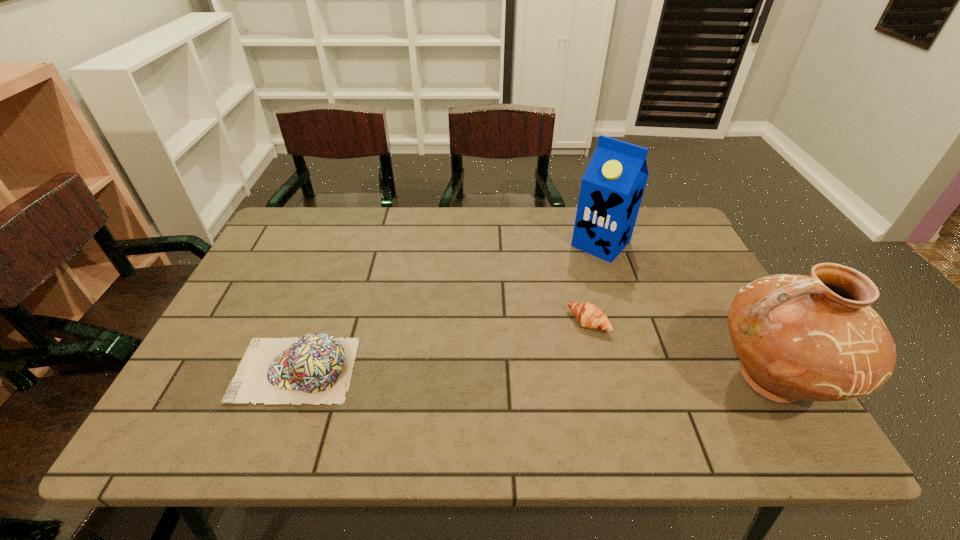
Find the location of `object positioned at the near left corner`. object positioned at the near left corner is located at coordinates (317, 368).

Where is `object present at the near right corner`? object present at the near right corner is located at coordinates (817, 338).

Where is `free space at the far edge of the desktop`? The width and height of the screenshot is (960, 540). free space at the far edge of the desktop is located at coordinates (463, 233).

This screenshot has height=540, width=960. I want to click on free space at the near edge of the desktop, so click(x=362, y=396).

Identify the location of vacant space at the left edge. This screenshot has width=960, height=540. (265, 280).

The height and width of the screenshot is (540, 960). I want to click on vacant area at the right edge, so click(679, 300).

The height and width of the screenshot is (540, 960). What are the coordinates of `vacant space at the far right corner of the desktop` in the screenshot? It's located at (651, 221).

This screenshot has width=960, height=540. What are the coordinates of `free space between the pottery and the shortest object` in the screenshot? It's located at coord(681,351).

This screenshot has height=540, width=960. I want to click on vacant region between the shortest object and the rightmost object, so click(x=681, y=351).

You are a GUI agent. You are given a task and a screenshot of the screen. Output one action in this format:
    pyautogui.click(x=<x>, y=<y>)
    Task: Click on the free space that is in between the farthest object and the third tallest object
    
    Given the screenshot: What is the action you would take?
    pyautogui.click(x=448, y=307)